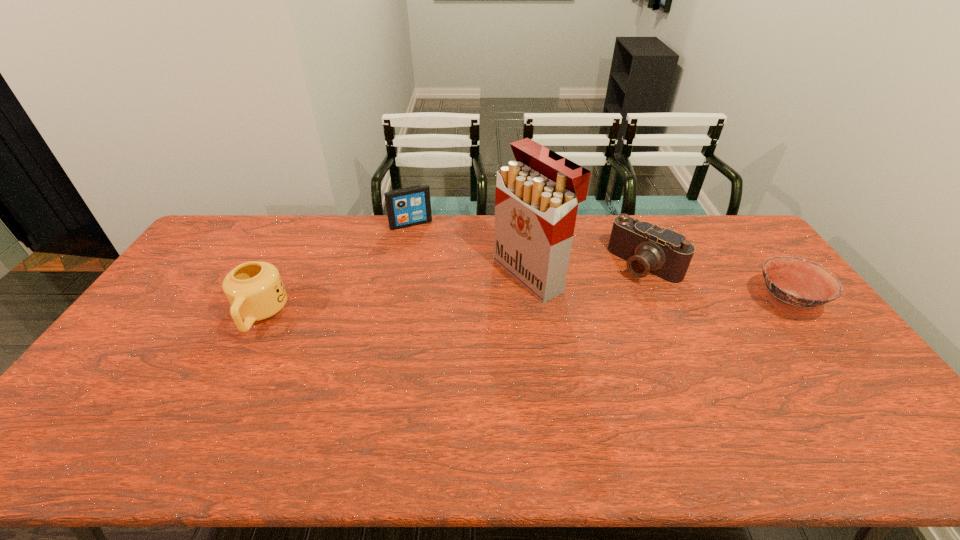
Where is `cigarette case located in the far edge section of the desktop`? cigarette case located in the far edge section of the desktop is located at coordinates (536, 200).

Where is `iPod that is at the far edge`? This screenshot has height=540, width=960. iPod that is at the far edge is located at coordinates (410, 206).

Locate an element on the screen. object that is at the right edge is located at coordinates (794, 285).

At what (x,y) coordinates should I click in order to perform the action: click on vacant space at the far edge of the desktop. Please return your answer as a coordinate pair (x, y). Looking at the image, I should click on pos(357,251).

Where is `free region at the near edge of the desktop`? free region at the near edge of the desktop is located at coordinates pyautogui.click(x=256, y=399).

Image resolution: width=960 pixels, height=540 pixels. In order to click on vacant space at the left edge of the desktop in this screenshot , I will do `click(194, 285)`.

Where is `free space at the right edge of the desktop`? Image resolution: width=960 pixels, height=540 pixels. free space at the right edge of the desktop is located at coordinates (799, 325).

The image size is (960, 540). In order to click on vacant space at the near right corner of the desktop in this screenshot , I will do `click(848, 406)`.

Find the location of a particular element. The height and width of the screenshot is (540, 960). vacant area that lies between the cigarette case and the bowl is located at coordinates (659, 289).

The image size is (960, 540). I want to click on empty space between the leftmost object and the farthest object, so click(336, 269).